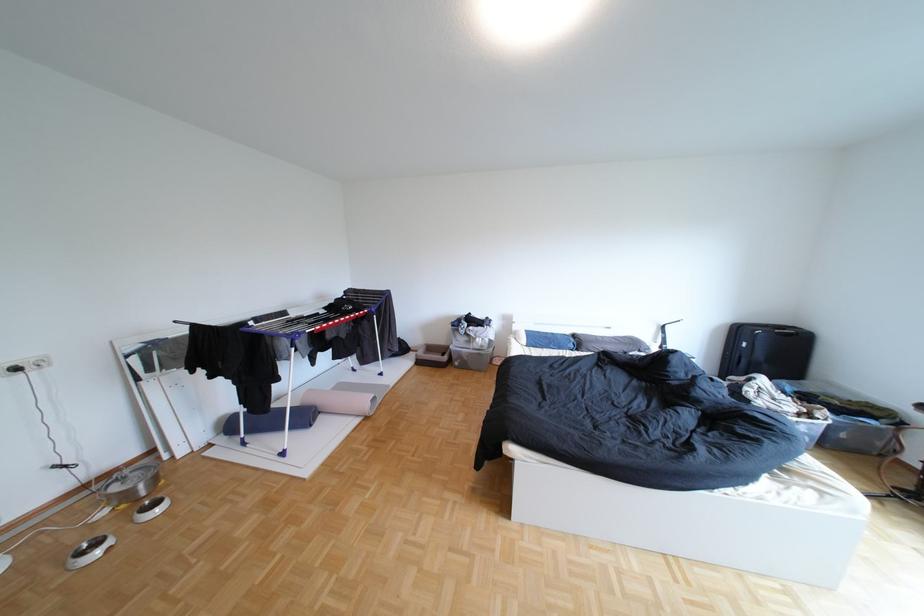
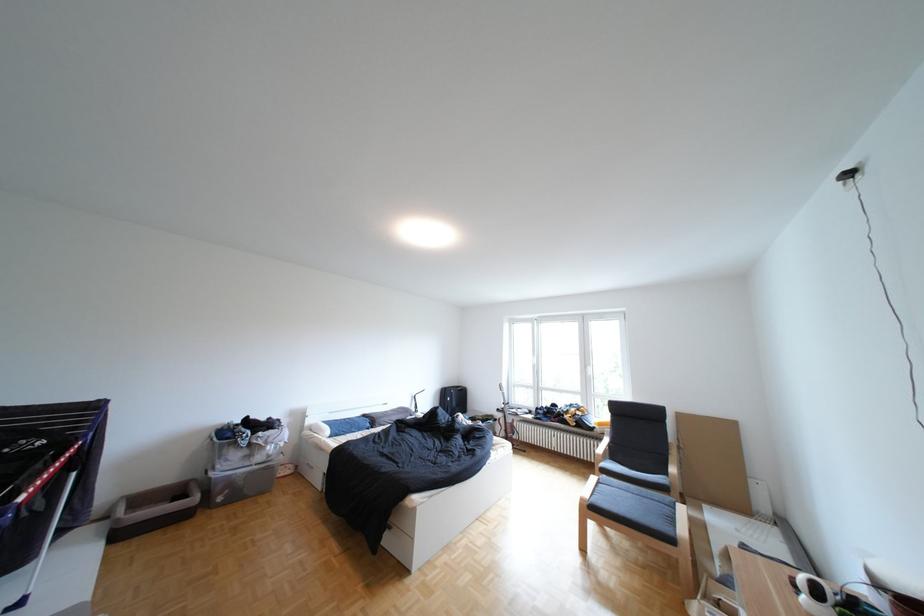
In the second image, find the point that corresponds to (x=434, y=363) in the first image.

(136, 536)